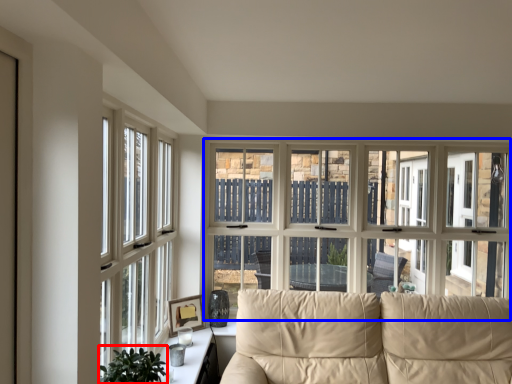
Question: Which object is further to the camera taking this photo, plant (highlighted by a red box) or window (highlighted by a blue box)?

Choices:
 (A) plant
 (B) window

Answer: (B)